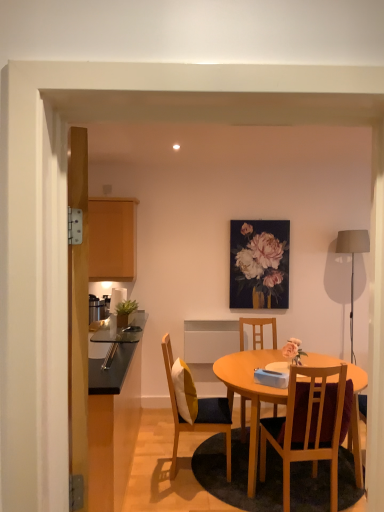
Question: Looking at their shapes, would you say matte gray fabric lampshade at right is wider or thinner than wooden chair at center, arranged as the first chair when viewed from the right?

Choices:
 (A) thin
 (B) wide

Answer: (A)

Question: Is point (337, 244) closer or farther from the camera than point (279, 439)?

Choices:
 (A) farther
 (B) closer

Answer: (A)

Question: Estimate the real-world distances between objects in this image. Which object is closer to the matte floral painting at upper center?

Choices:
 (A) wooden table at center
 (B) wooden chair at center, which ranks as the 2th chair in left-to-right order
 (C) matte wood cabinet at left
 (D) wooden chair with cushion at center, arranged as the 3th chair when viewed from the right
 (E) matte gray fabric lampshade at right

Answer: (B)

Question: Which of these objects is positioned farthest from the wooden chair with cushion at center, the 1th chair from the left?

Choices:
 (A) wooden table at center
 (B) wooden chair at center, which appears as the 1th chair when viewed from the front
 (C) matte floral painting at upper center
 (D) wooden chair at center, the first chair in the back-to-front sequence
 (E) matte wood cabinet at left

Answer: (C)